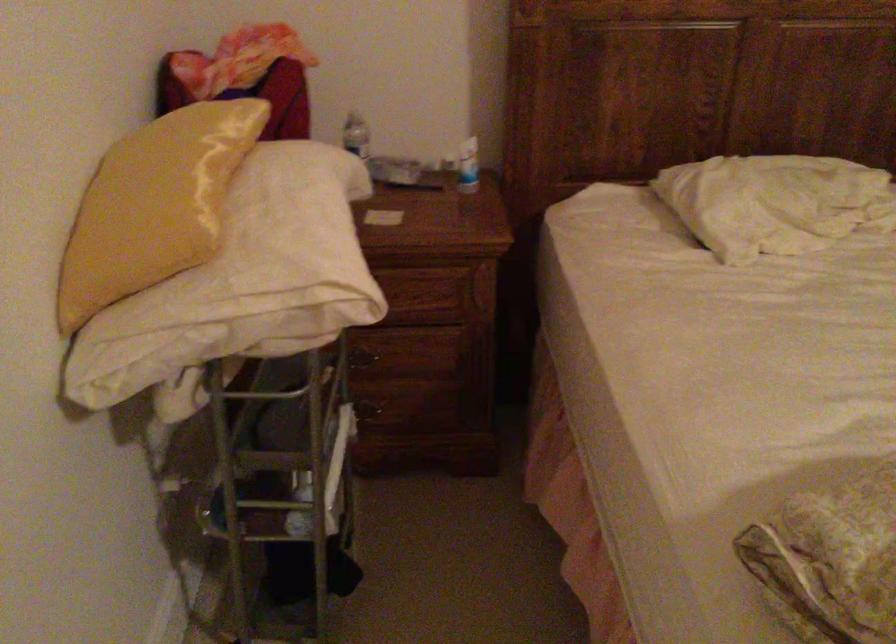
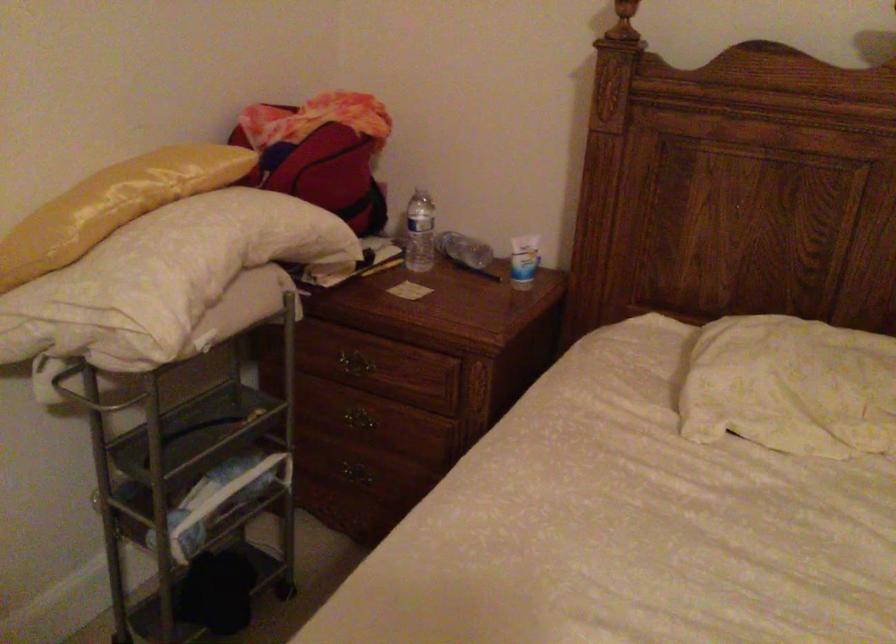
The point at (363, 410) is marked in the first image. Where is the corresponding point in the second image?

(355, 473)